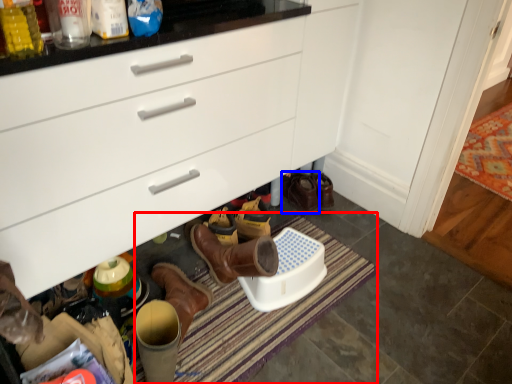
Question: Which object is closer to the camera taking this photo, bath mat (highlighted by a red box) or footwear (highlighted by a blue box)?

Choices:
 (A) bath mat
 (B) footwear

Answer: (A)